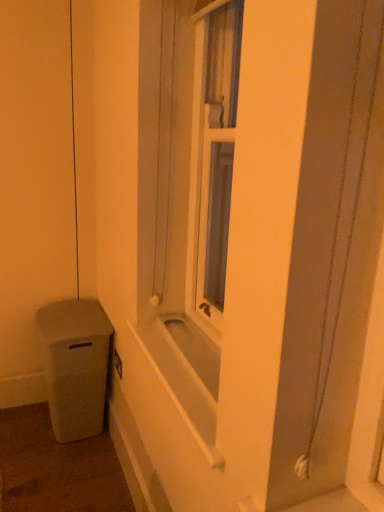
Question: Considering the relative positions of white matte bathtub at center and matte gray trash can at lower left in the image provided, is white matte bathtub at center in front of matte gray trash can at lower left?

Choices:
 (A) no
 (B) yes

Answer: (B)

Question: Does white matte bathtub at center have a greater height compared to matte gray trash can at lower left?

Choices:
 (A) yes
 (B) no

Answer: (B)

Question: Is white matte bathtub at center not within matte gray trash can at lower left?

Choices:
 (A) yes
 (B) no

Answer: (A)

Question: Is white matte bathtub at center far away from matte gray trash can at lower left?

Choices:
 (A) no
 (B) yes

Answer: (A)

Question: Considering the relative sizes of white matte bathtub at center and matte gray trash can at lower left in the image provided, is white matte bathtub at center smaller than matte gray trash can at lower left?

Choices:
 (A) yes
 (B) no

Answer: (A)

Question: Is white matte bathtub at center to the left of matte gray trash can at lower left from the viewer's perspective?

Choices:
 (A) no
 (B) yes

Answer: (A)

Question: Does matte gray trash can at lower left have a greater height compared to white matte bathtub at center?

Choices:
 (A) no
 (B) yes

Answer: (B)

Question: Is the position of matte gray trash can at lower left less distant than that of white matte bathtub at center?

Choices:
 (A) yes
 (B) no

Answer: (B)

Question: Is matte gray trash can at lower left turned away from white matte bathtub at center?

Choices:
 (A) no
 (B) yes

Answer: (A)

Question: Is matte gray trash can at lower left at the left side of white matte bathtub at center?

Choices:
 (A) no
 (B) yes

Answer: (B)

Question: Considering the relative sizes of matte gray trash can at lower left and white matte bathtub at center in the image provided, is matte gray trash can at lower left thinner than white matte bathtub at center?

Choices:
 (A) yes
 (B) no

Answer: (B)

Question: From the image's perspective, is matte gray trash can at lower left beneath white matte bathtub at center?

Choices:
 (A) no
 (B) yes

Answer: (B)

Question: Considering the relative positions of white matte bathtub at center and matte gray trash can at lower left in the image provided, is white matte bathtub at center to the left or to the right of matte gray trash can at lower left?

Choices:
 (A) left
 (B) right

Answer: (B)